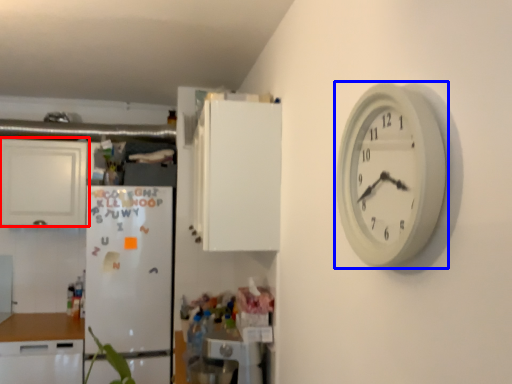
Question: Which point is further to the camera, cabinetry (highlighted by a red box) or wall clock (highlighted by a blue box)?

Choices:
 (A) cabinetry
 (B) wall clock

Answer: (A)